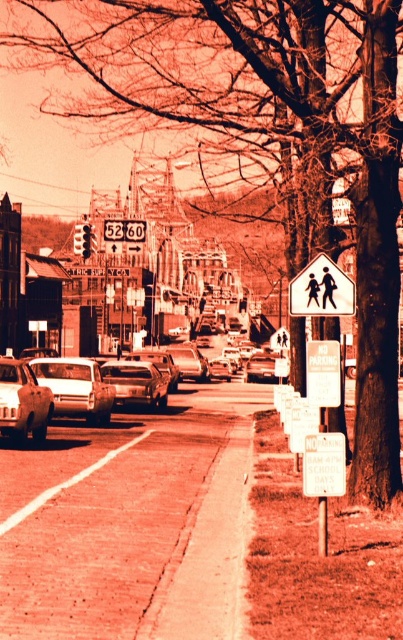
You are a delivery driver who needs to park your matte white car at center in a spot that is exactly as wide as the white plastic pedestrian crossing sign at center. Based on the scene, can your car fit in that spot?

The matte white car at center is wider than the white plastic pedestrian crossing sign at center, so it cannot fit into a parking spot that is exactly as wide as the sign.

You are a delivery driver who needs to park your matte white car at center near the white plastic pedestrian crossing sign at center. According to the No Parking sign, can you park there during school hours on a school day?

The matte white car at center is positioned under the white plastic pedestrian crossing sign at center. The No Parking sign specifies restrictions during school days from 8 AM to 4 PM. Therefore, you cannot park the matte white car at center there during those times.